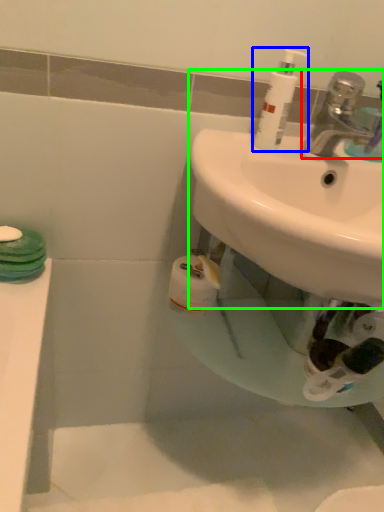
Question: Estimate the real-world distances between objects in this image. Which object is farther from tap (highlighted by a red box), cleaning product (highlighted by a blue box) or sink (highlighted by a green box)?

Choices:
 (A) cleaning product
 (B) sink

Answer: (B)